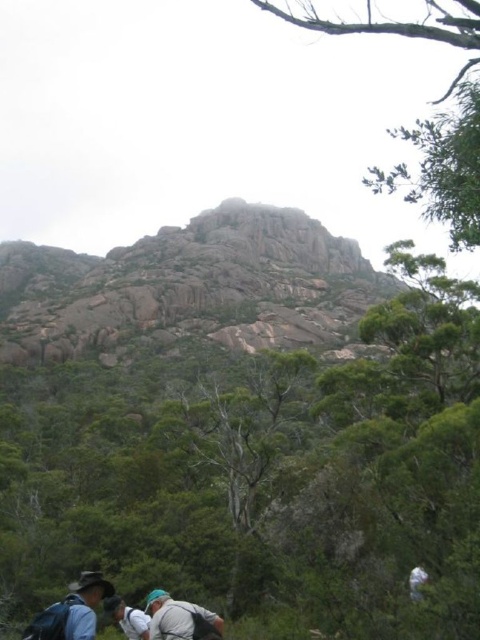
Question: Is rocky gray mountain at center smaller than light gray fabric backpack at lower center?

Choices:
 (A) no
 (B) yes

Answer: (A)

Question: Does light blue fabric backpack at lower left appear on the left side of light gray fabric backpack at lower center?

Choices:
 (A) yes
 (B) no

Answer: (A)

Question: Which point appears closest to the camera in this image?

Choices:
 (A) [x=64, y=600]
 (B) [x=189, y=630]
 (C) [x=295, y=260]

Answer: (B)

Question: Among these objects, which one is farthest from the camera?

Choices:
 (A) light blue fabric backpack at lower left
 (B) rocky gray mountain at center
 (C) light gray fabric backpack at lower center

Answer: (B)

Question: Which object appears closest to the camera in this image?

Choices:
 (A) rocky gray mountain at center
 (B) light blue fabric backpack at lower left
 (C) light gray fabric backpack at lower center

Answer: (B)

Question: Is light blue fabric backpack at lower left positioned before light gray fabric backpack at lower center?

Choices:
 (A) yes
 (B) no

Answer: (A)